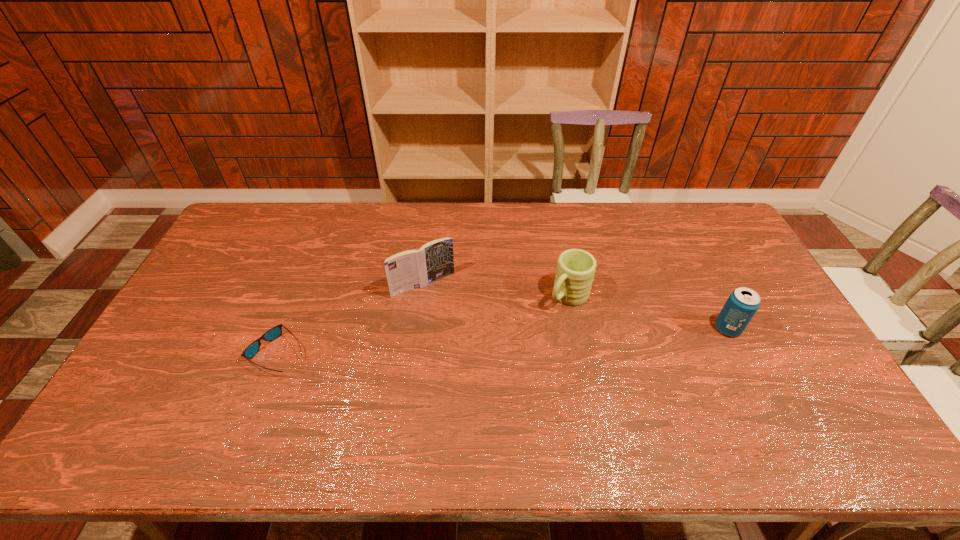
At what (x,y) coordinates should I click in order to perform the action: click on vacant area situated on the front cover of the third object from right to left. Please return your answer as a coordinate pair (x, y). Looking at the image, I should click on (505, 396).

Find the location of a particular element. This screenshot has width=960, height=540. vacant space located on the front cover of the third object from right to left is located at coordinates (482, 362).

The width and height of the screenshot is (960, 540). I want to click on free space located on the side of the mug with the handle, so click(x=540, y=324).

Locate an element on the screen. The width and height of the screenshot is (960, 540). free space located on the side of the mug with the handle is located at coordinates (506, 357).

I want to click on free space located on the side of the mug with the handle, so click(524, 340).

Locate an element on the screen. object present at the right edge is located at coordinates (742, 304).

Where is `free space at the far edge`? free space at the far edge is located at coordinates (515, 204).

Identify the location of vacant region at the near edge. (297, 389).

The height and width of the screenshot is (540, 960). I want to click on free space at the left edge, so click(210, 264).

At what (x,y) coordinates should I click in order to perform the action: click on vacant space at the right edge of the desktop. Please return your answer as a coordinate pair (x, y). The image size is (960, 540). Looking at the image, I should click on (767, 303).